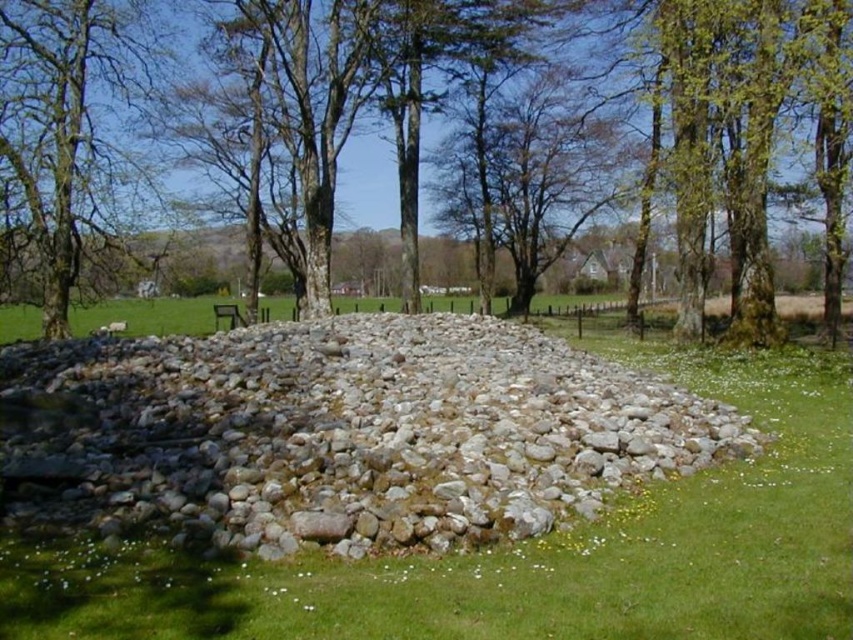
You are standing at the center of the circular stone cairn and want to find the smooth bark tree at center. In which direction should you look to see it?

The smooth bark tree at center is located at the center of the scene, so you should look straight ahead from the center of the circular stone cairn to find it.

You are standing in front of the large circular stone cairn and notice two points marked in the image. The first point is at coordinates point (548, 483) and the second is at point (685, 285). Which of these points is nearer to your current position?

Point (548, 483) is closer to the camera than point (685, 285), so the first point is nearer to your current position.